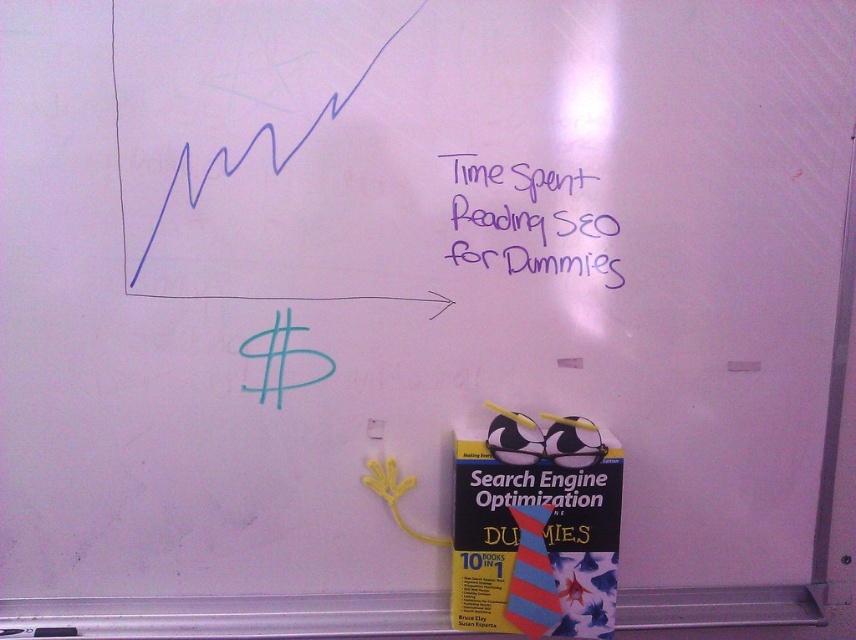
Where is `purple marker writing at upper right`? This screenshot has width=856, height=640. purple marker writing at upper right is located at coordinates (532, 220).